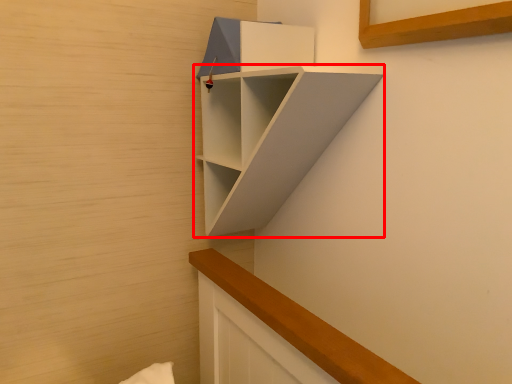
Question: Observing the image, what is the correct spatial positioning of shelf (annotated by the red box) in reference to cabinet?

Choices:
 (A) right
 (B) left

Answer: (A)